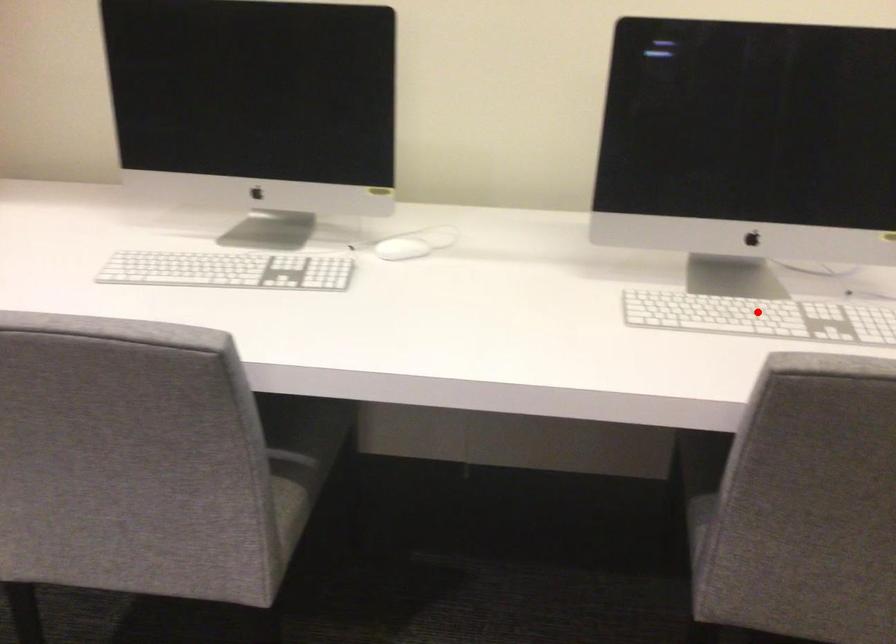
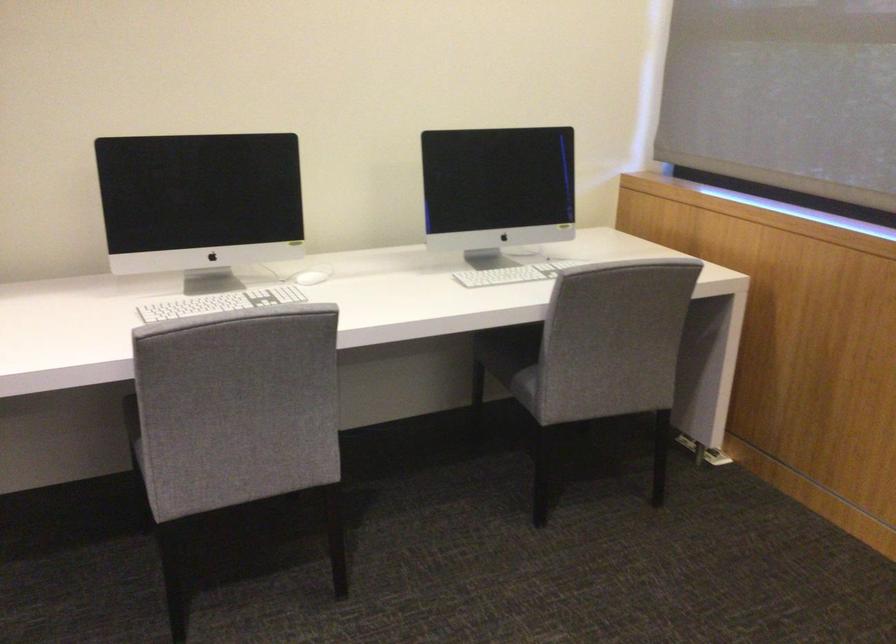
Question: I am providing you with two images of the same scene from different viewpoints. Image1 has a red point marked. In image2, the corresponding 3D location appears at what relative position? Reply with the corresponding letter.

Choices:
 (A) Closer
 (B) Farther

Answer: (B)